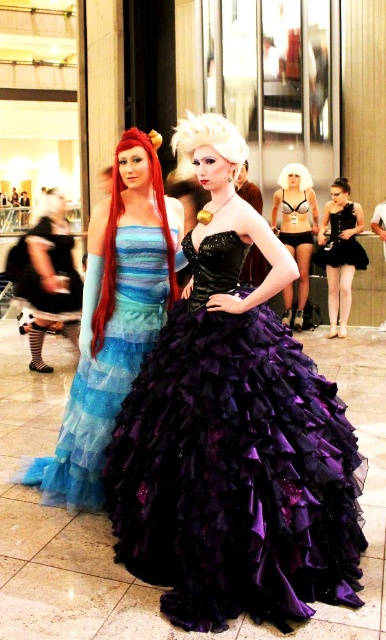
You are a photographer at the event and need to position a spotlight. The spotlight can only illuminate objects within a 0.25 unit radius from its center. If you aim the spotlight at coordinates point 0.359, 0.301, will it illuminate the shiny red wig at left?

The position of shiny red wig at left is at point (116, 228). Since the spotlight is aimed directly at this point with a 0.25 unit radius, the entire wig will be illuminated as it is centered within the spotlight.

You are a photographer at the event and need to position a spotlight on the black satin dress at center without shining it on the shiny red wig at left. Based on their positions, is this possible?

The shiny red wig at left is located below the black satin dress at center, so positioning the spotlight directly above the black satin dress at center would illuminate it while avoiding the shiny red wig at left below it.

You are at a cosplay event and see the shiny purple gown at center. Where exactly is it located in terms of coordinates?

The shiny purple gown at center is located at point [235,444].